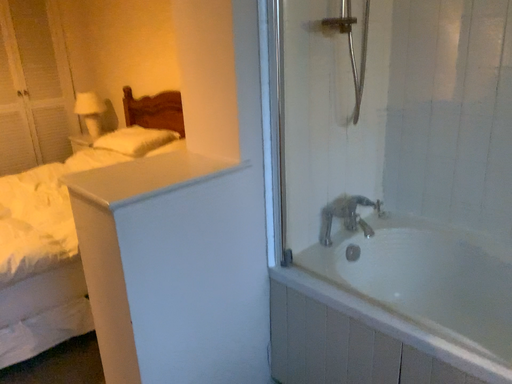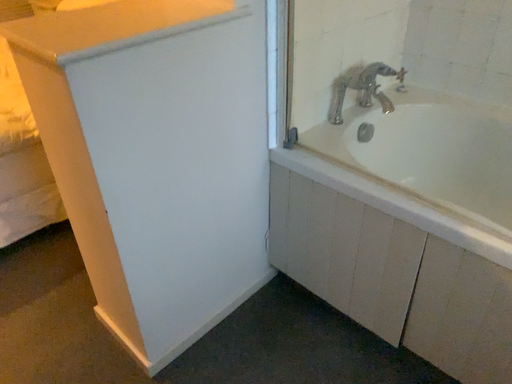
Question: How did the camera likely rotate when shooting the video?

Choices:
 (A) rotated downward
 (B) rotated upward

Answer: (A)